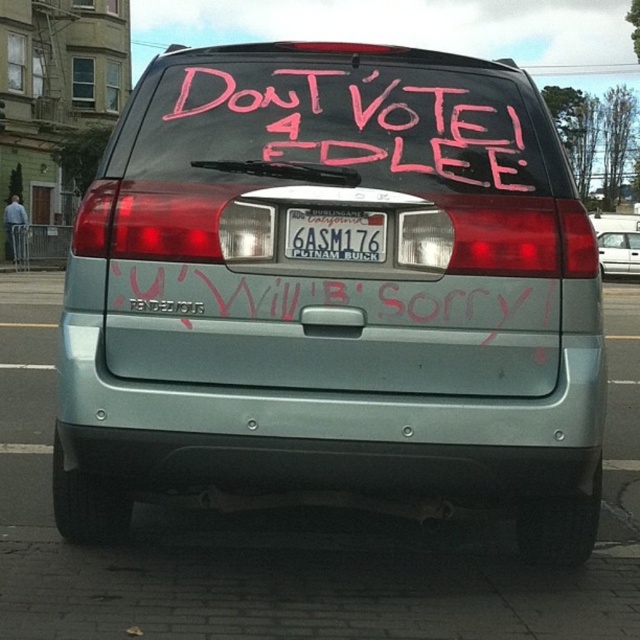
Question: Estimate the real-world distances between objects in this image. Which object is closer to the white plastic license plate at center?

Choices:
 (A) pink chalk writing at center
 (B) satin silver sedan at center

Answer: (A)

Question: Does pink chalk writing at center appear over white plastic license plate at center?

Choices:
 (A) yes
 (B) no

Answer: (A)

Question: Which point is closer to the camera?

Choices:
 (A) satin silver sedan at center
 (B) satin silver minivan at center
 (C) pink chalk writing at center
 (D) white plastic license plate at center

Answer: (B)

Question: Does satin silver minivan at center have a greater width compared to pink chalk writing at center?

Choices:
 (A) yes
 (B) no

Answer: (A)

Question: Is the position of pink chalk writing at center less distant than that of white plastic license plate at center?

Choices:
 (A) yes
 (B) no

Answer: (B)

Question: Based on their relative distances, which object is farther from the white plastic license plate at center?

Choices:
 (A) satin silver minivan at center
 (B) pink chalk writing at center

Answer: (A)